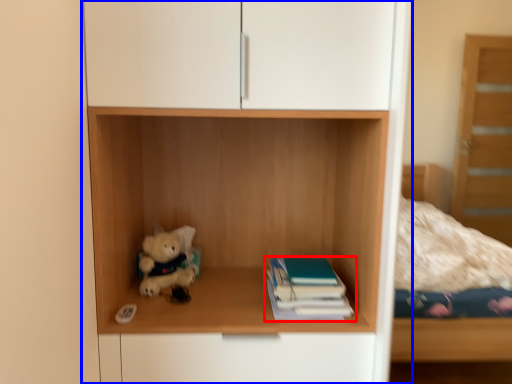
Question: Which of the following is the closest to the observer, book (highlighted by a red box) or cupboard (highlighted by a blue box)?

Choices:
 (A) book
 (B) cupboard

Answer: (B)